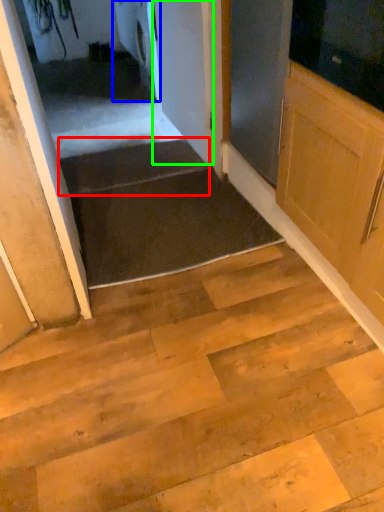
Question: Which is farther away from stairs (highlighted by a red box)? appliance (highlighted by a blue box) or door (highlighted by a green box)?

Choices:
 (A) appliance
 (B) door

Answer: (A)